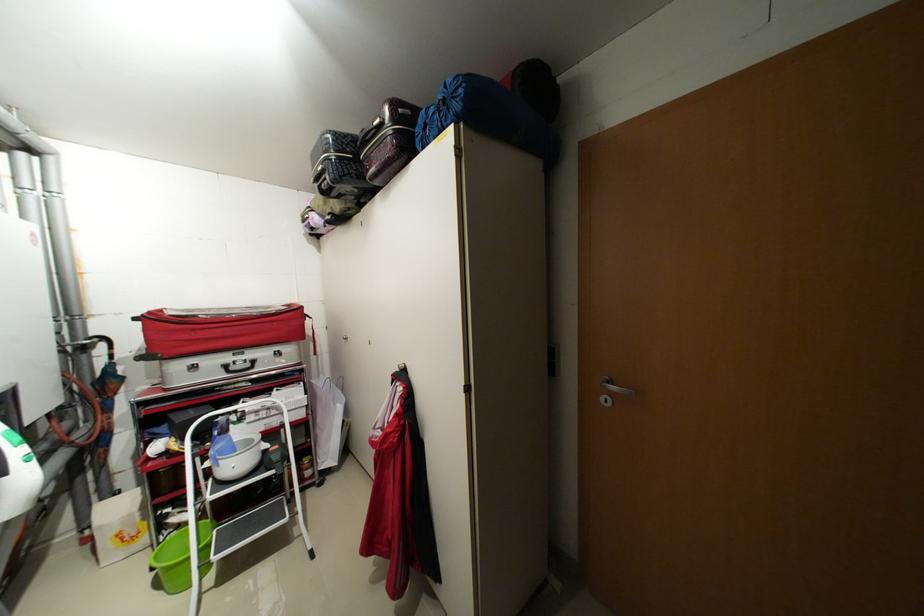
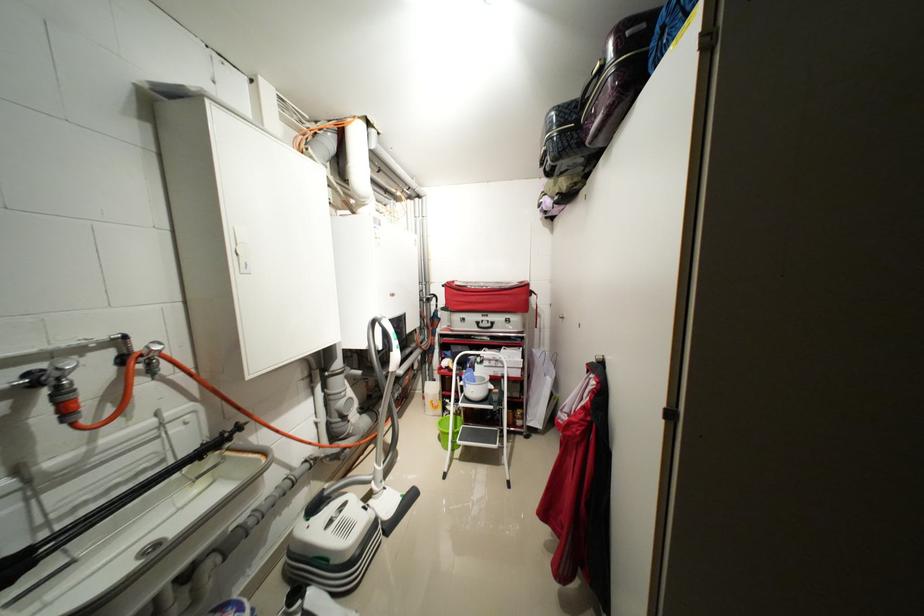
In the second image, find the point that corresponds to (369,177) in the first image.

(589, 145)